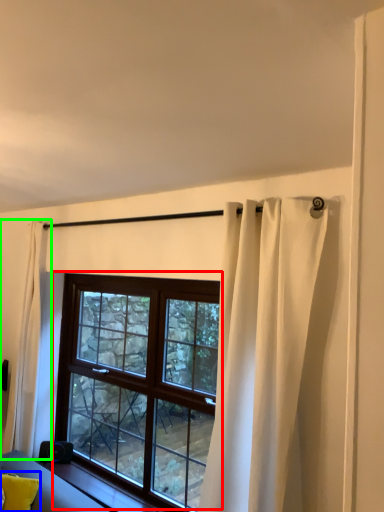
Question: Based on their relative distances, which object is farther from window (highlighted by a red box)? Choose from pillow (highlighted by a blue box) and curtain (highlighted by a green box).

Choices:
 (A) pillow
 (B) curtain

Answer: (A)